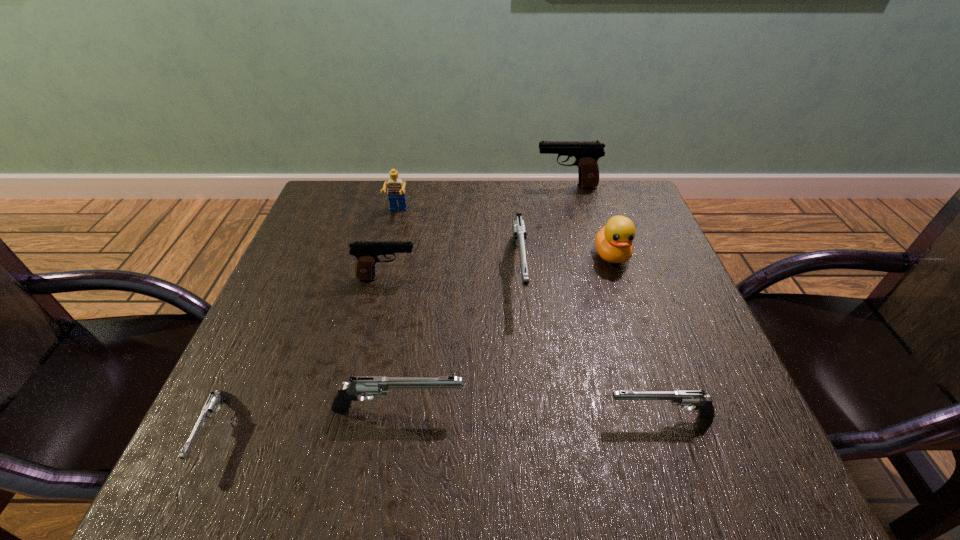
The width and height of the screenshot is (960, 540). In order to click on free space located on the front-facing side of the third pistol from right to left in this screenshot , I will do `click(526, 355)`.

Where is `free space located at the barrel of the smaller black pistol`? This screenshot has height=540, width=960. free space located at the barrel of the smaller black pistol is located at coordinates (538, 278).

Locate an element on the screen. The height and width of the screenshot is (540, 960). free space located on the front-facing side of the second silver pistol from left to right is located at coordinates (652, 408).

I want to click on vacant position located 0.300m on the front-facing side of the second smallest silver pistol, so click(427, 416).

The height and width of the screenshot is (540, 960). What are the coordinates of `blank area located on the front-facing side of the second smallest silver pistol` in the screenshot? It's located at (469, 416).

Locate an element on the screen. The height and width of the screenshot is (540, 960). vacant space located on the front-facing side of the second smallest silver pistol is located at coordinates (451, 416).

At what (x,y) coordinates should I click in order to perform the action: click on pistol located at the far edge. Please return your answer as a coordinate pair (x, y). This screenshot has width=960, height=540. Looking at the image, I should click on (586, 153).

The width and height of the screenshot is (960, 540). Find the location of `Lego present at the far edge`. Lego present at the far edge is located at coordinates (396, 191).

Identify the location of object that is at the near edge. The image size is (960, 540). (219, 397).

The height and width of the screenshot is (540, 960). Find the location of `object that is positioned at the left edge`. object that is positioned at the left edge is located at coordinates (219, 397).